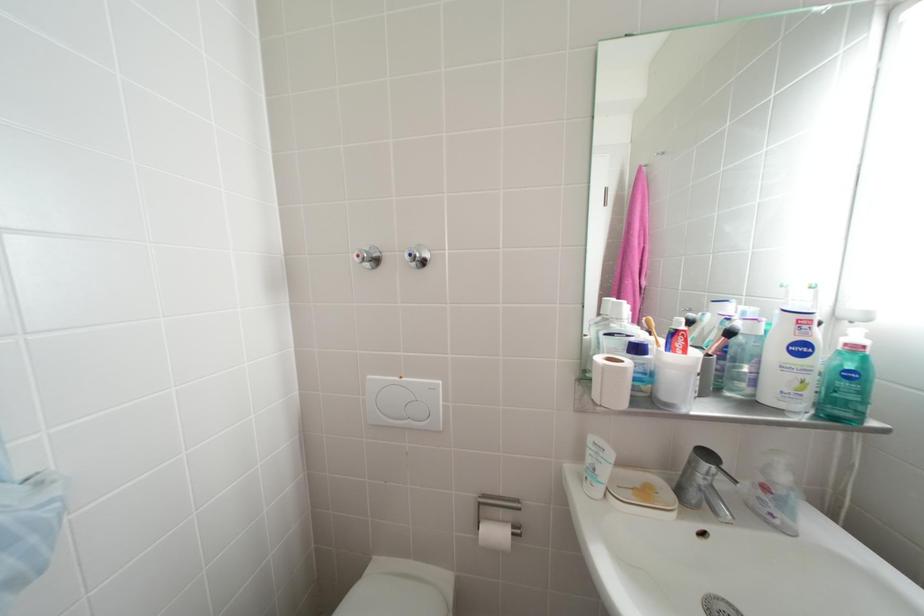
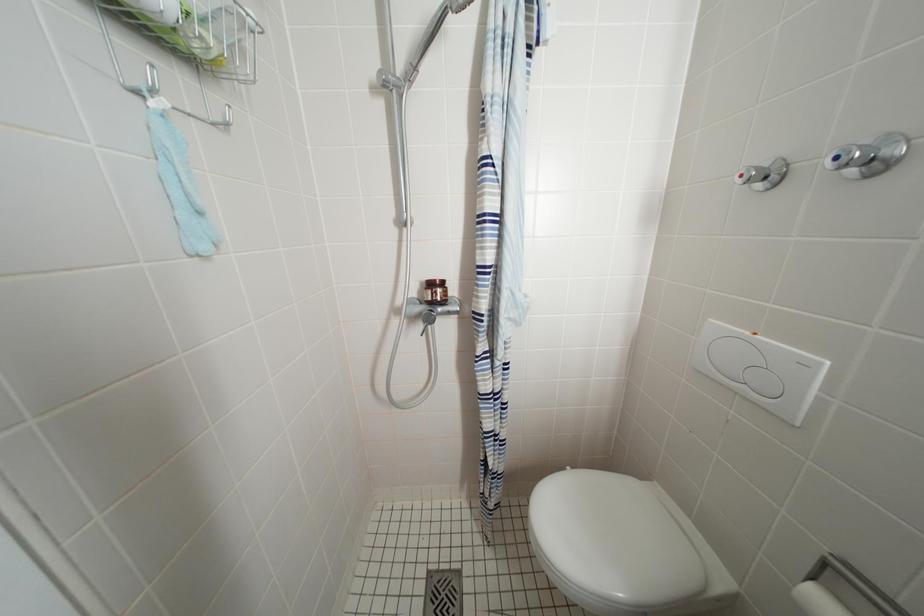
The first image is from the beginning of the video and the second image is from the end. How did the camera likely rotate when shooting the video?

The rotation direction of the camera is left-down.